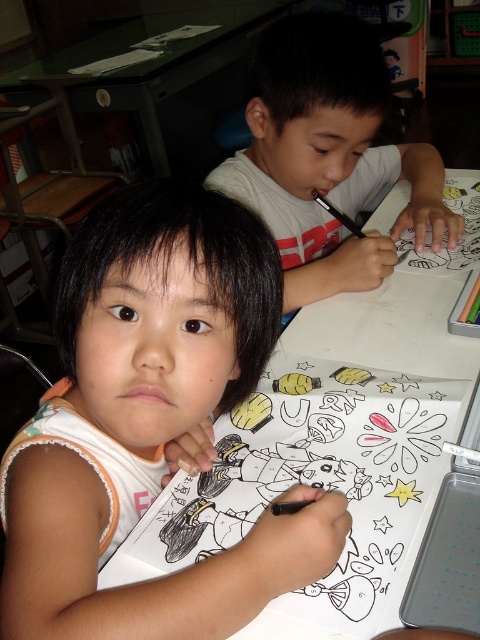
In the scene shown: Is matte orange shirt at center smaller than white matte shirt at upper center?

Correct, matte orange shirt at center occupies less space than white matte shirt at upper center.

Where is `matte orange shirt at center`? The height and width of the screenshot is (640, 480). matte orange shirt at center is located at coordinates (151, 420).

Where is `matte orange shirt at center`? The width and height of the screenshot is (480, 640). matte orange shirt at center is located at coordinates (151, 420).

Who is positioned more to the right, matte orange shirt at center or matte green crayon at upper right?

Positioned to the right is matte green crayon at upper right.

Can you confirm if matte orange shirt at center is shorter than matte green crayon at upper right?

No, matte orange shirt at center is not shorter than matte green crayon at upper right.

Does point (135, 401) come farther from viewer compared to point (463, 310)?

No, (135, 401) is in front of (463, 310).

At what (x,y) coordinates should I click in order to perform the action: click on matte orange shirt at center. Please return your answer as a coordinate pair (x, y). Image resolution: width=480 pixels, height=640 pixels. Looking at the image, I should click on (151, 420).

Does black ink pen at upper center come behind matte green crayon at upper right?

No, black ink pen at upper center is in front of matte green crayon at upper right.

Locate an element on the screen. This screenshot has height=640, width=480. black ink pen at upper center is located at coordinates tap(320, 476).